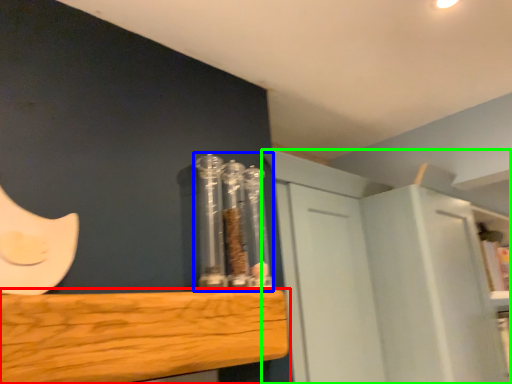
Question: Based on their relative distances, which object is farther from furniture (highlighted by a red box)? Choose from glass jar (highlighted by a blue box) and cabinetry (highlighted by a green box).

Choices:
 (A) glass jar
 (B) cabinetry

Answer: (B)